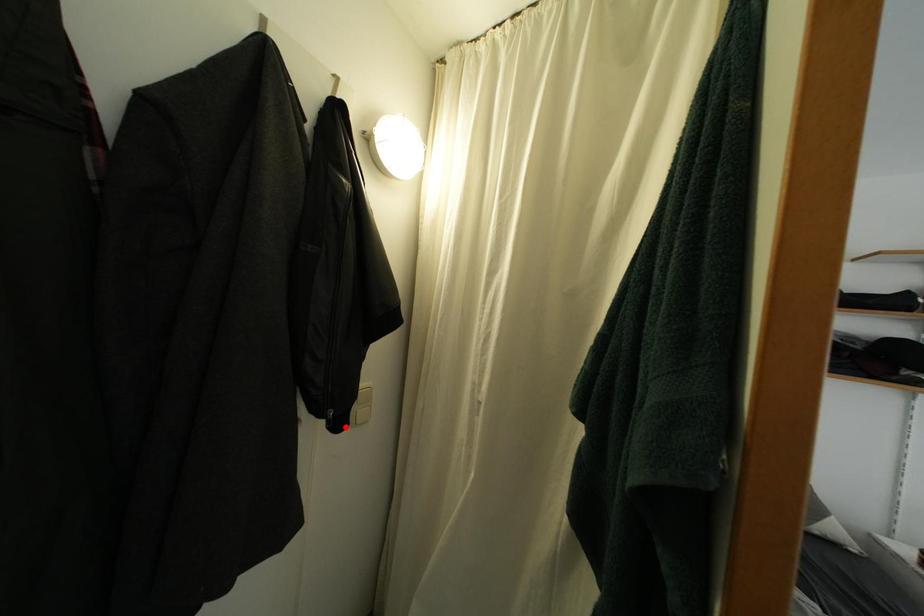
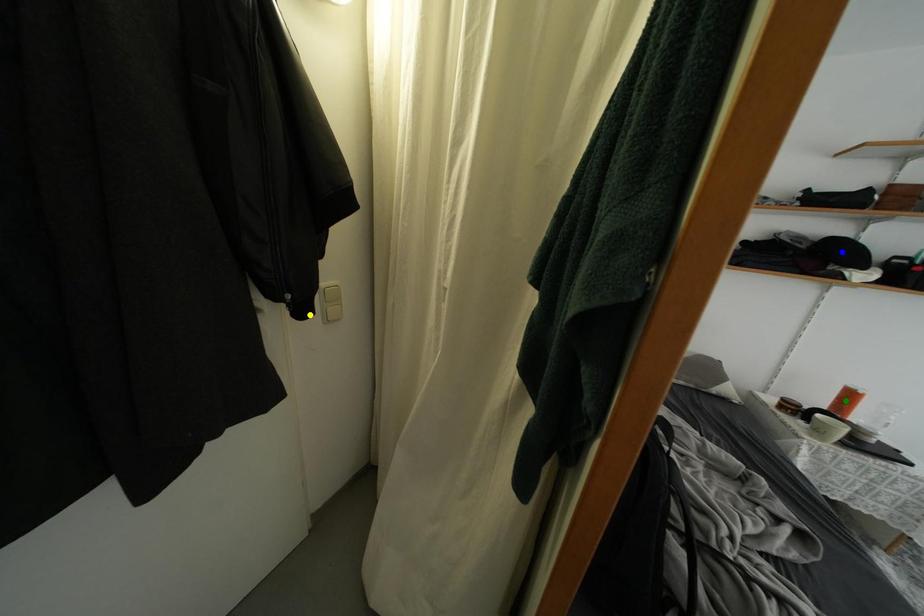
Question: I am providing you with two images of the same scene from different viewpoints. A red point is marked on the first image. You are given multiple points on the second image. Which point in image 2 represents the same 3d spot as the red point in image 1?

Choices:
 (A) yellow point
 (B) blue point
 (C) green point

Answer: (A)